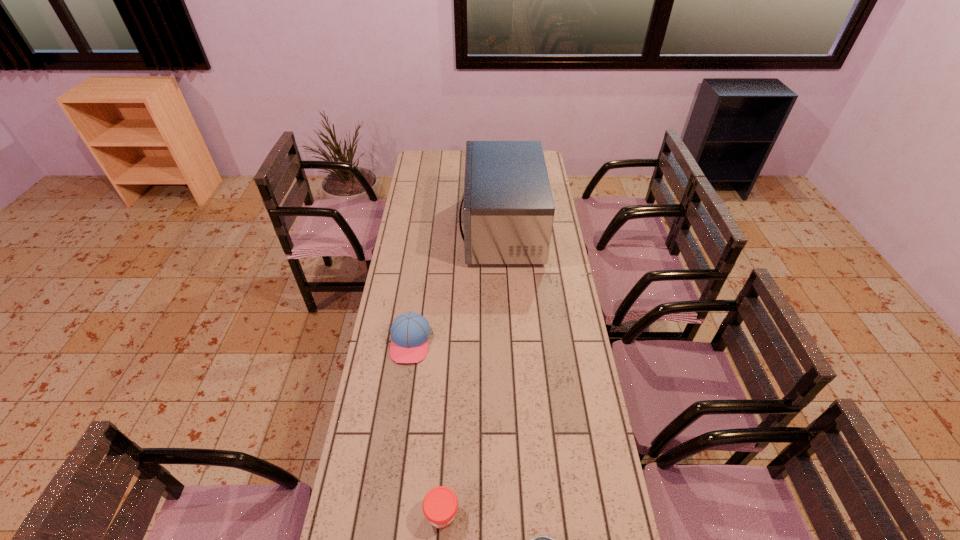
Where is `microwave oven`? Image resolution: width=960 pixels, height=540 pixels. microwave oven is located at coordinates pos(508,210).

The image size is (960, 540). I want to click on the farthest object, so click(508, 210).

Locate an element on the screen. Image resolution: width=960 pixels, height=540 pixels. the third shortest object is located at coordinates (410, 332).

I want to click on the leftmost object, so click(x=410, y=332).

At what (x,y) coordinates should I click in order to perform the action: click on the second nearest object. Please return your answer as a coordinate pair (x, y). The height and width of the screenshot is (540, 960). Looking at the image, I should click on (440, 504).

Find the location of a particular element. Image resolution: width=960 pixels, height=540 pixels. the third tallest object is located at coordinates click(440, 504).

Image resolution: width=960 pixels, height=540 pixels. Identify the location of vacant space located 0.120m on the front-facing side of the farthest object. (436, 229).

Image resolution: width=960 pixels, height=540 pixels. Find the location of `vacant region located on the front-facing side of the farthest object`. vacant region located on the front-facing side of the farthest object is located at coordinates (441, 229).

Where is `vacant area located on the front-facing side of the farthest object`? vacant area located on the front-facing side of the farthest object is located at coordinates (415, 229).

Locate an element on the screen. vacant space located on the front-facing side of the third nearest object is located at coordinates (393, 468).